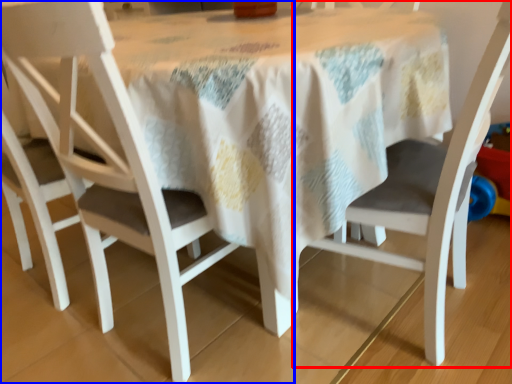
Question: Which of the following is the closest to the observer, chair (highlighted by a red box) or chair (highlighted by a blue box)?

Choices:
 (A) chair
 (B) chair

Answer: (A)